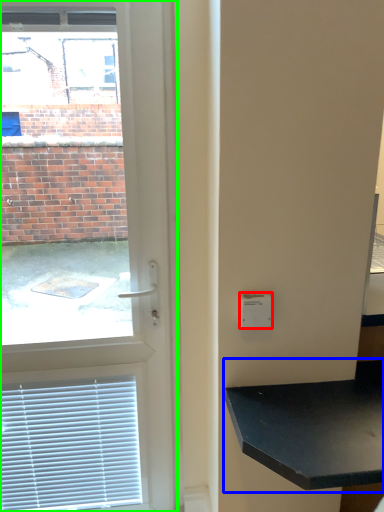
Question: Estimate the real-world distances between objects in this image. Which object is closer to light switch (highlighted by a red box), table (highlighted by a blue box) or door (highlighted by a green box)?

Choices:
 (A) table
 (B) door

Answer: (A)